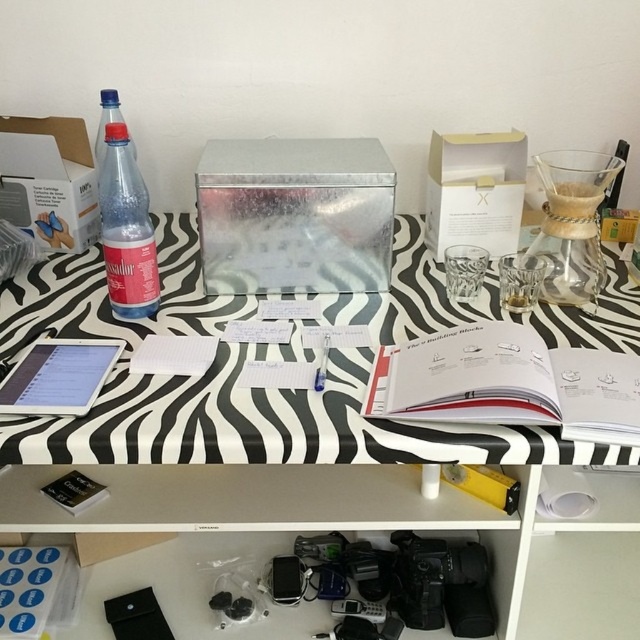
Question: Which point is closer to the camera?

Choices:
 (A) translucent plastic bottle at left
 (B) zebra-patterned table at center

Answer: (B)

Question: Can you confirm if zebra-patterned table at center is wider than translucent plastic bottle at left?

Choices:
 (A) no
 (B) yes

Answer: (B)

Question: Is zebra-patterned table at center further to camera compared to translucent plastic bottle at left?

Choices:
 (A) yes
 (B) no

Answer: (B)

Question: Which point is closer to the camera taking this photo?

Choices:
 (A) (35, 272)
 (B) (128, 273)

Answer: (B)

Question: Does zebra-patterned table at center have a greater width compared to translucent plastic bottle at left?

Choices:
 (A) no
 (B) yes

Answer: (B)